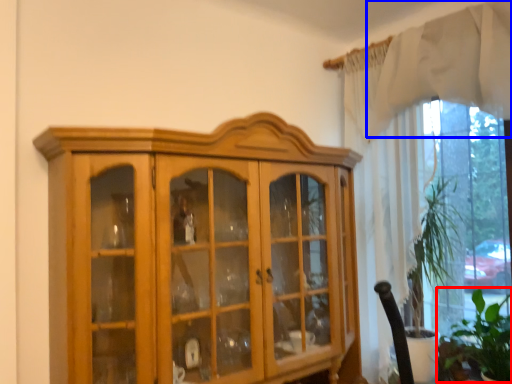
Question: Among these objects, which one is nearest to the camera, plant (highlighted by a red box) or curtain (highlighted by a blue box)?

Choices:
 (A) plant
 (B) curtain

Answer: (B)